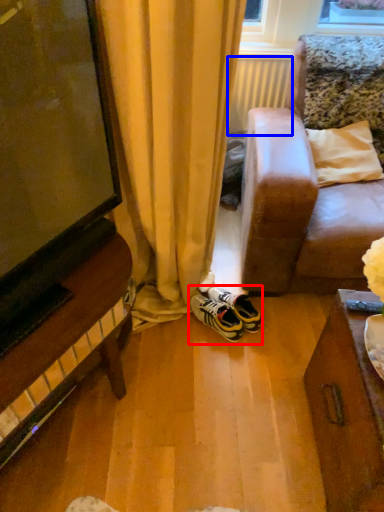
Question: Which of the following is the farthest to the observer, footwear (highlighted by a red box) or radiator (highlighted by a blue box)?

Choices:
 (A) footwear
 (B) radiator

Answer: (B)